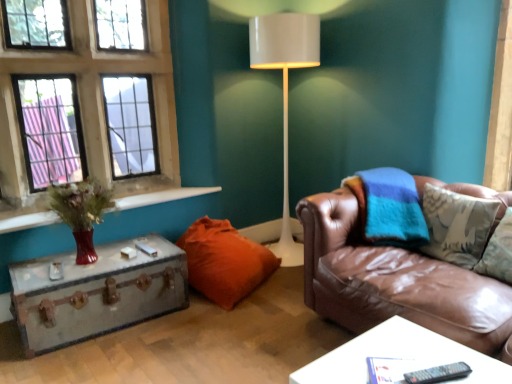
Question: Does metallic suitcase at left, which ranks as the second table in front-to-back order, have a lesser height compared to matte glass vase at left?

Choices:
 (A) yes
 (B) no

Answer: (B)

Question: Is metallic suitcase at left, the 1th table from the left, located outside matte glass vase at left?

Choices:
 (A) no
 (B) yes

Answer: (B)

Question: From the image's perspective, would you say metallic suitcase at left, which ranks as the second table in front-to-back order, is shown under matte glass vase at left?

Choices:
 (A) no
 (B) yes

Answer: (B)

Question: Does metallic suitcase at left, the 1th table from the left, have a greater height compared to matte glass vase at left?

Choices:
 (A) no
 (B) yes

Answer: (B)

Question: From the image's perspective, is metallic suitcase at left, the 1th table in the back-to-front sequence, above matte glass vase at left?

Choices:
 (A) no
 (B) yes

Answer: (A)

Question: Is metallic suitcase at left, the 1th table from the left, surrounding matte glass vase at left?

Choices:
 (A) no
 (B) yes

Answer: (A)

Question: Would you consider matte glass vase at left to be distant from black plastic remote at lower right?

Choices:
 (A) yes
 (B) no

Answer: (A)

Question: Is black plastic remote at lower right a part of matte glass vase at left?

Choices:
 (A) no
 (B) yes

Answer: (A)

Question: Is matte glass vase at left positioned before black plastic remote at lower right?

Choices:
 (A) no
 (B) yes

Answer: (A)

Question: Is matte glass vase at left not inside black plastic remote at lower right?

Choices:
 (A) no
 (B) yes

Answer: (B)

Question: Does matte glass vase at left have a lesser height compared to black plastic remote at lower right?

Choices:
 (A) yes
 (B) no

Answer: (B)

Question: From a real-world perspective, is matte glass vase at left located higher than black plastic remote at lower right?

Choices:
 (A) yes
 (B) no

Answer: (A)

Question: From a real-world perspective, is white glossy table at lower right, positioned as the second table in left-to-right order, beneath brown leather couch at right?

Choices:
 (A) no
 (B) yes

Answer: (B)